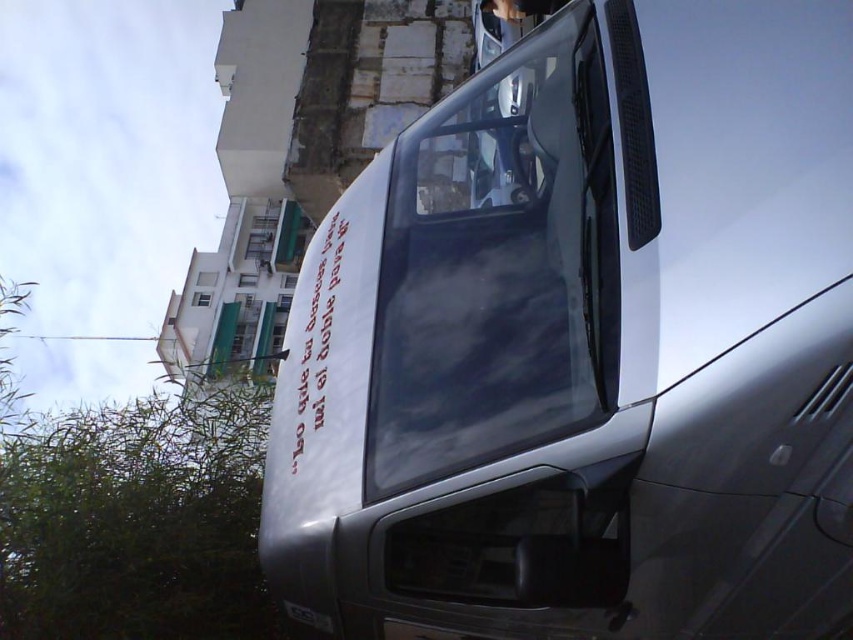
You are a delivery person trying to see the building address displayed on the windows. Which window should you look at first, the transparent glass windshield at center or the white glass window at upper left?

The transparent glass windshield at center is below the white glass window at upper left, so you should look at the white glass window at upper left first since it is higher up and closer to your line of sight.

You are a delivery driver who needs to park the satin metallic van at center in a parking spot that is the same size as the white glass window at upper left. Based on the scene, will the van fit in the parking spot?

The satin metallic van at center is wider than the white glass window at upper left, so it will not fit in the parking spot of the same size.

You are a delivery person who needs to park the satin metallic van at center under the green awnings. The parking spot is marked by the white glass window at upper left. Will the van fit vertically without hitting the awnings?

The satin metallic van at center is taller than the white glass window at upper left, so it will not fit under the awnings without hitting them.